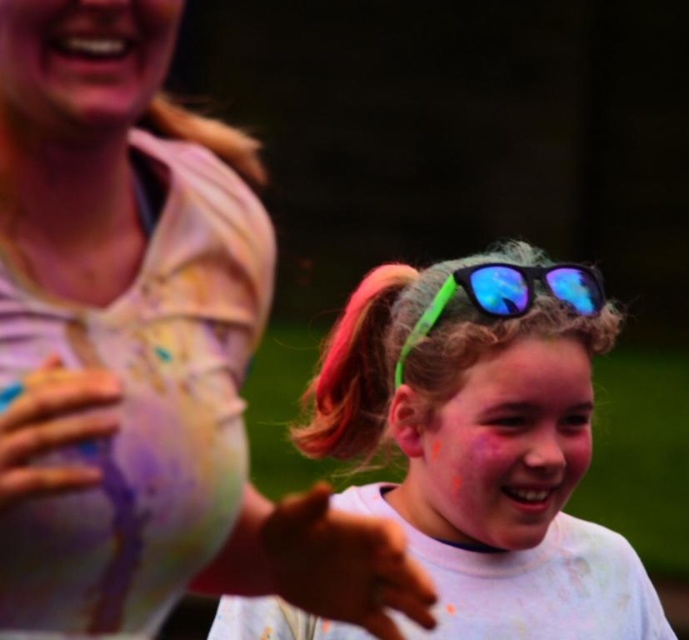
You are a photographer trying to capture a closeup shot of the neon green plastic sunglasses at center and the pink fabric hand at center. Which object should you focus on to ensure the other remains in the background?

You should focus on the neon green plastic sunglasses at center because it is closer to the viewer than the pink fabric hand at center, so focusing on it will keep the pink fabric hand at center in the background.

From the picture: You are a photographer trying to capture the perfect shot of the matte white face at center and the smooth white glove at left. Based on their sizes in the image, which object would you focus on first to ensure clarity?

The matte white face at center is wider than the smooth white glove at left, so focusing on the matte white face at center first would ensure clarity due to its larger size in the frame.